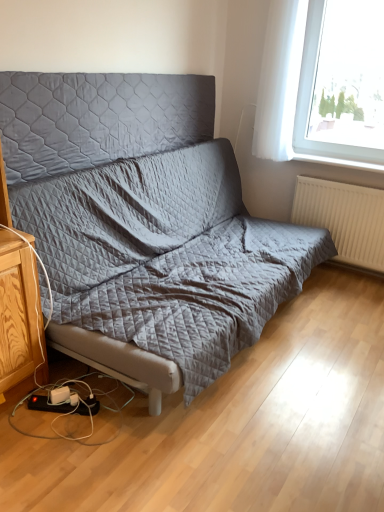
At what (x,y) coordinates should I click in order to perform the action: click on vacant space in front of white textured radiator at right. Please return your answer as a coordinate pair (x, y). Image resolution: width=384 pixels, height=512 pixels. Looking at the image, I should click on (343, 291).